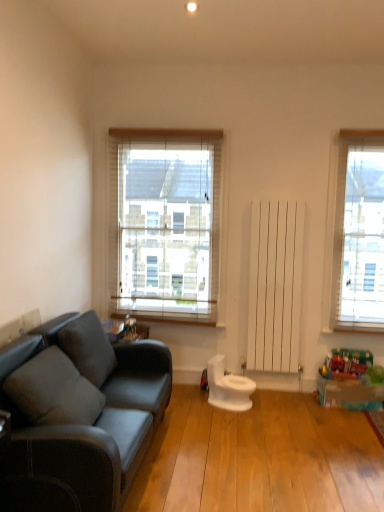
What are the coordinates of `vacant space that is to the left of translucent plastic toy at lower right, acting as the first toy starting from the bottom` in the screenshot? It's located at (294, 405).